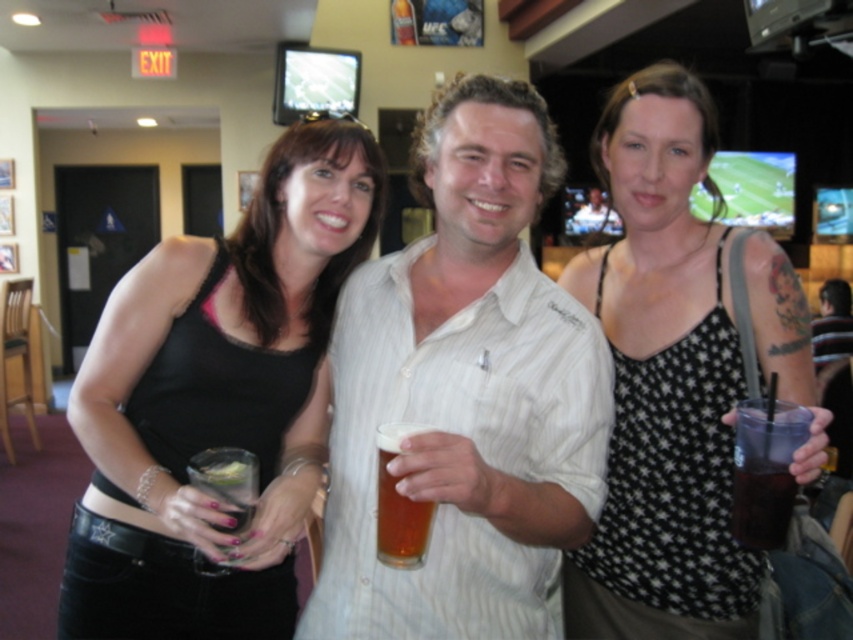
Which is more to the right, black star-patterned tank top at center or translucent glass beer at center?

black star-patterned tank top at center

Does point (637, 172) come in front of point (426, 512)?

No, (637, 172) is further to viewer.

The width and height of the screenshot is (853, 640). I want to click on black star-patterned tank top at center, so coord(663,381).

I want to click on black star-patterned tank top at center, so click(663, 381).

Does white striped shirt at center have a lesser width compared to black fabric tank top at center?

Correct, white striped shirt at center's width is less than black fabric tank top at center's.

Does point (451, 147) lie behind point (146, 417)?

No.

Identify the location of white striped shirt at center. The height and width of the screenshot is (640, 853). (465, 392).

Does black fabric tank top at center appear on the right side of black star-patterned tank top at center?

No, black fabric tank top at center is not to the right of black star-patterned tank top at center.

Can you confirm if black fabric tank top at center is positioned above black star-patterned tank top at center?

No.

Which is in front, point (280, 348) or point (668, 128)?

Point (668, 128) is in front.

Where is `black fabric tank top at center`? The width and height of the screenshot is (853, 640). black fabric tank top at center is located at coordinates (212, 396).